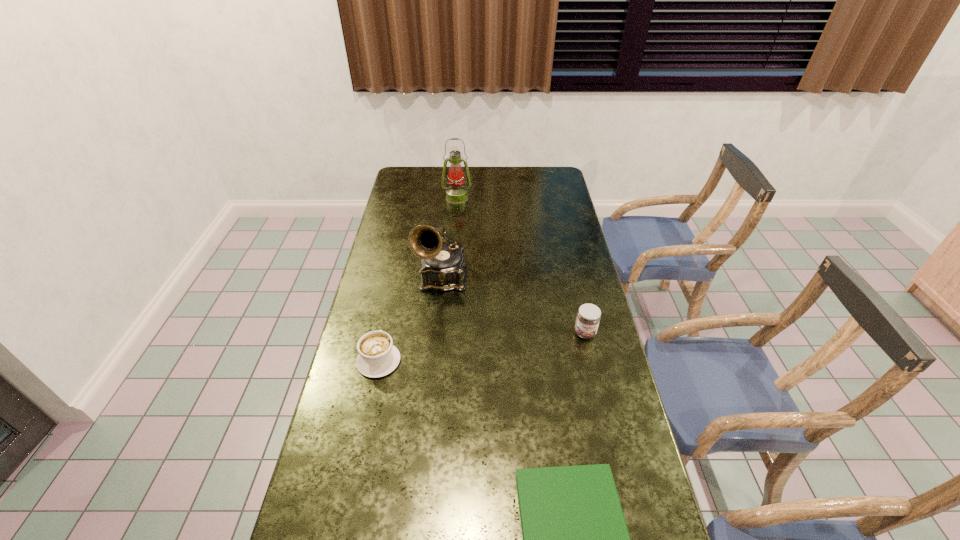
The height and width of the screenshot is (540, 960). Identify the location of oil lamp. (456, 193).

Locate an element on the screen. phonograph record is located at coordinates (443, 267).

Where is `jam`? jam is located at coordinates (588, 318).

Locate an element on the screen. This screenshot has width=960, height=540. the third tallest object is located at coordinates (588, 318).

The image size is (960, 540). In order to click on cappuccino in this screenshot , I will do `click(377, 357)`.

This screenshot has width=960, height=540. Identify the location of the fourth farthest object. (377, 357).

You are a GUI agent. You are given a task and a screenshot of the screen. Output one action in this format:
    pyautogui.click(x=<x>, y=<y>)
    Task: Click on the vacant region located on the left of the farthest object
    The image size is (960, 540).
    Given the screenshot: What is the action you would take?
    pyautogui.click(x=394, y=198)

Locate an element on the screen. Image resolution: width=960 pixels, height=540 pixels. vacant space situated on the horn of the phonograph record is located at coordinates (433, 368).

Identify the location of vacant space located 0.400m on the front label of the third tallest object. The width and height of the screenshot is (960, 540). (616, 467).

Find the location of a particular element. free region located to the right of the second nearest object's handle is located at coordinates (392, 298).